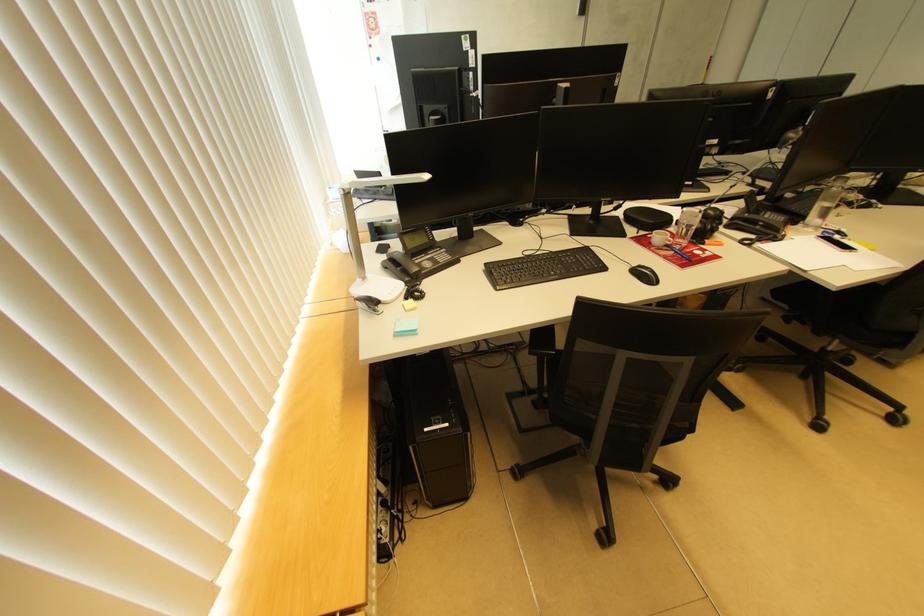
I want to click on yellow highlighter, so click(x=309, y=471).